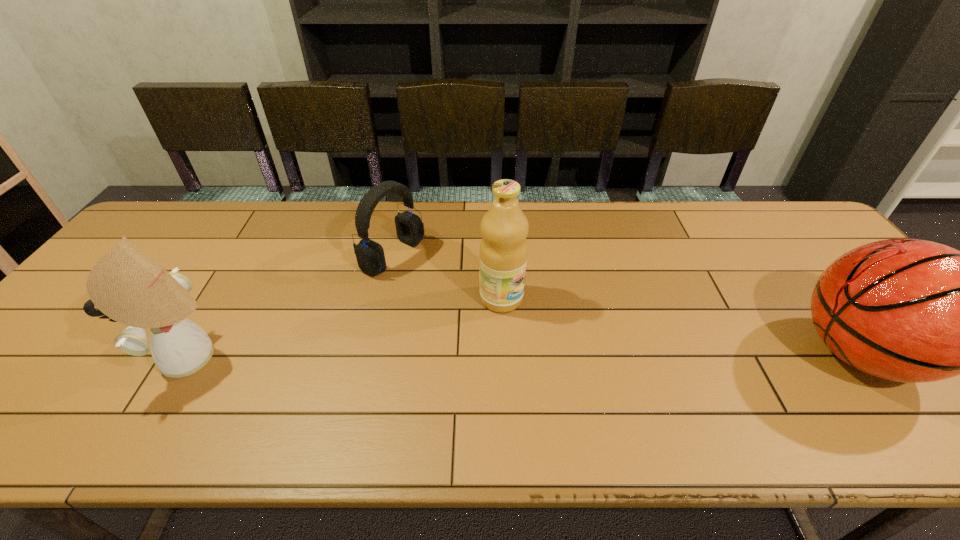
Where is `doll`? doll is located at coordinates (126, 285).

Locate an element on the screen. the second object from left to right is located at coordinates (370, 256).

Identify the location of the farthest object. (370, 256).

Find the location of `the second object from right to left`. the second object from right to left is located at coordinates (504, 227).

The image size is (960, 540). Identify the location of free point located at the front face of the doll. (125, 357).

Identify the location of free space located 0.230m at the front face of the doll. Image resolution: width=960 pixels, height=540 pixels. (65, 357).

Identify the location of vacant space located at the front face of the doll. This screenshot has height=540, width=960. (78, 357).

At what (x,y) coordinates should I click in order to perform the action: click on vacant area located on the headband of the headset. Please return your answer as a coordinate pair (x, y). The height and width of the screenshot is (540, 960). Looking at the image, I should click on (502, 312).

Locate an element on the screen. free space located 0.100m on the headband of the headset is located at coordinates (444, 283).

Locate an element on the screen. The image size is (960, 540). free space located 0.340m on the headband of the headset is located at coordinates (518, 320).